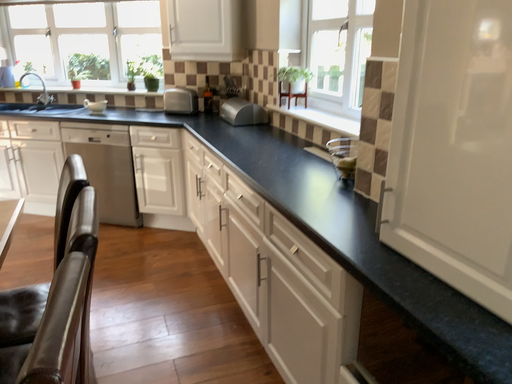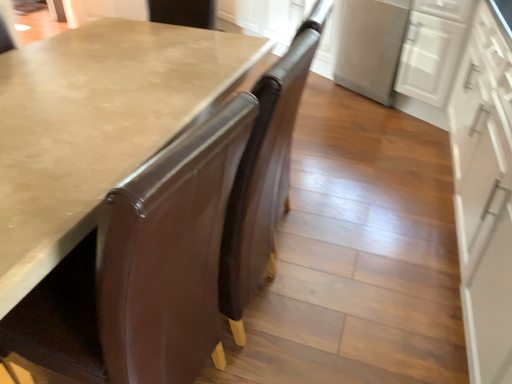
Question: How did the camera likely rotate when shooting the video?

Choices:
 (A) rotated upward
 (B) rotated downward

Answer: (B)